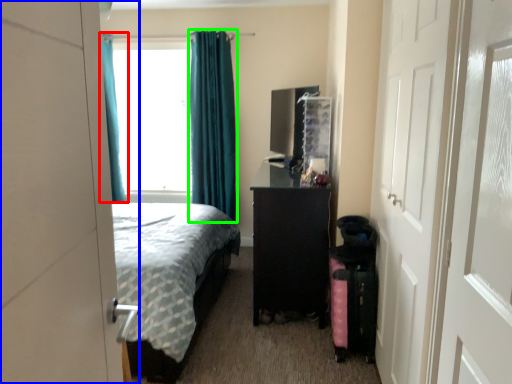
Question: Considering the real-world distances, which object is farthest from curtain (highlighted by a red box)? door (highlighted by a blue box) or curtain (highlighted by a green box)?

Choices:
 (A) door
 (B) curtain

Answer: (A)